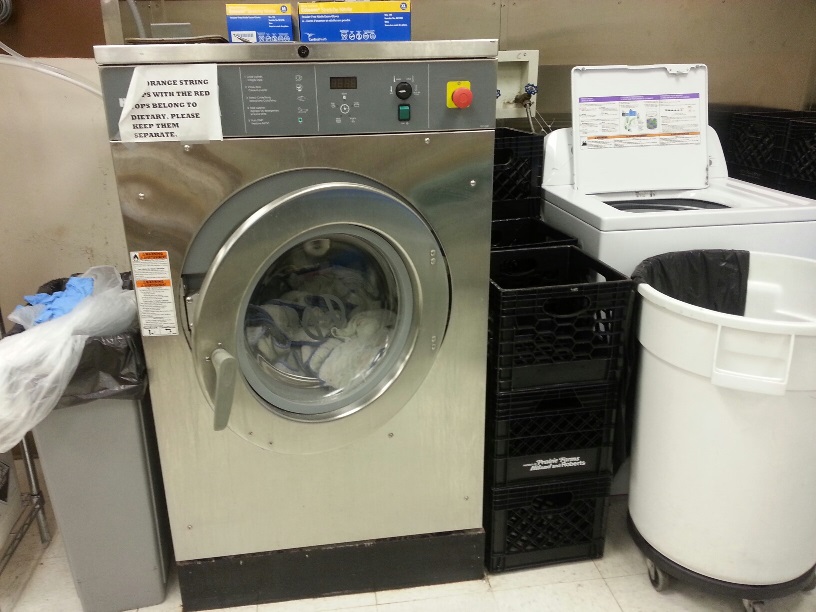
Where is `white garbage can`? The image size is (816, 612). white garbage can is located at coordinates (734, 436).